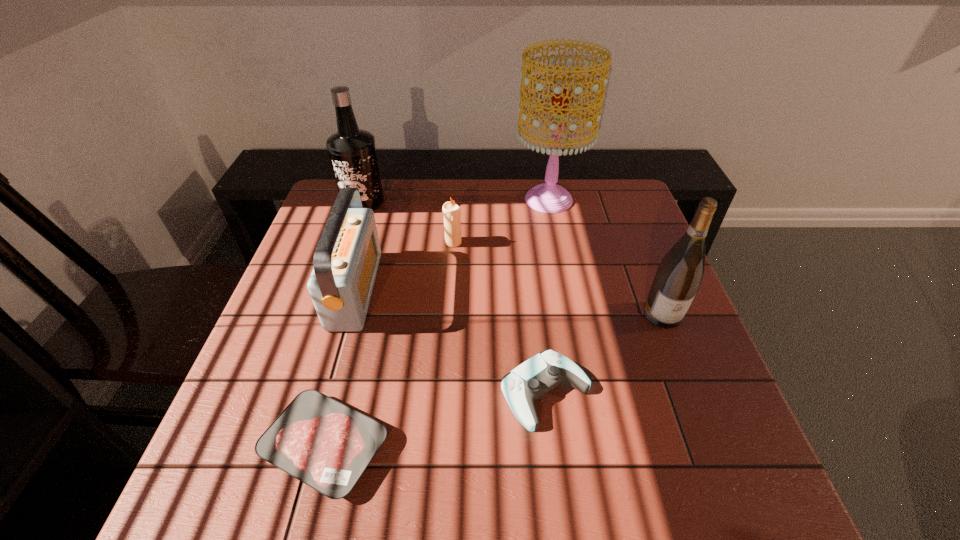
Identify which object is the fourth nearest to the tallest object. Please provide its 2D coordinates. Your answer should be formatted as a tuple, i.e. [(x, y)], where the tuple contains the x and y coordinates of a point satisfying the conditions above.

[(352, 151)]

This screenshot has height=540, width=960. In order to click on free space that satisfies the following two spatial constraints: 1. on the back side of the tallest object; 2. on the right side of the steak in this screenshot , I will do `click(390, 199)`.

Find the location of a particular element. Image resolution: width=960 pixels, height=540 pixels. free space that satisfies the following two spatial constraints: 1. on the front-facing side of the fourth shortest object; 2. on the back side of the sixth tallest object is located at coordinates (326, 392).

Locate an element on the screen. The height and width of the screenshot is (540, 960). vacant position in the image that satisfies the following two spatial constraints: 1. on the front-facing side of the second shortest object; 2. on the left side of the radio receiver is located at coordinates (326, 392).

Where is `free location that satisfies the following two spatial constraints: 1. on the front label of the liquor; 2. on the right side of the shortest object`? free location that satisfies the following two spatial constraints: 1. on the front label of the liquor; 2. on the right side of the shortest object is located at coordinates pos(281,446).

Find the location of `vacant space that satisfies the following two spatial constraints: 1. on the back side of the third shortest object; 2. on the right side of the tallest object`. vacant space that satisfies the following two spatial constraints: 1. on the back side of the third shortest object; 2. on the right side of the tallest object is located at coordinates (456, 199).